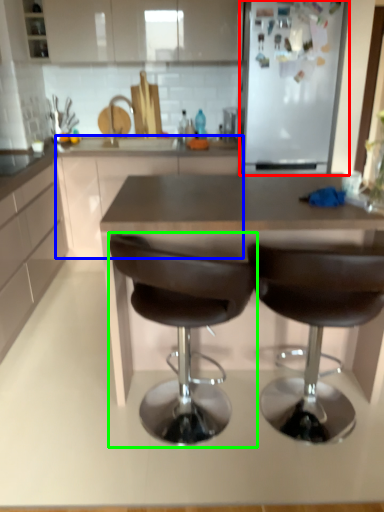
Question: Based on their relative distances, which object is nearer to fridge (highlighted by a red box)? Choose from counter (highlighted by a blue box) and chair (highlighted by a green box).

Choices:
 (A) counter
 (B) chair

Answer: (A)